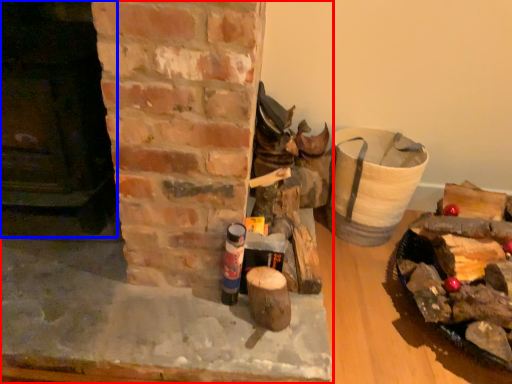
Question: Which object appears closest to the camera in this image, fireplace (highlighted by a red box) or fireplace (highlighted by a blue box)?

Choices:
 (A) fireplace
 (B) fireplace

Answer: (B)